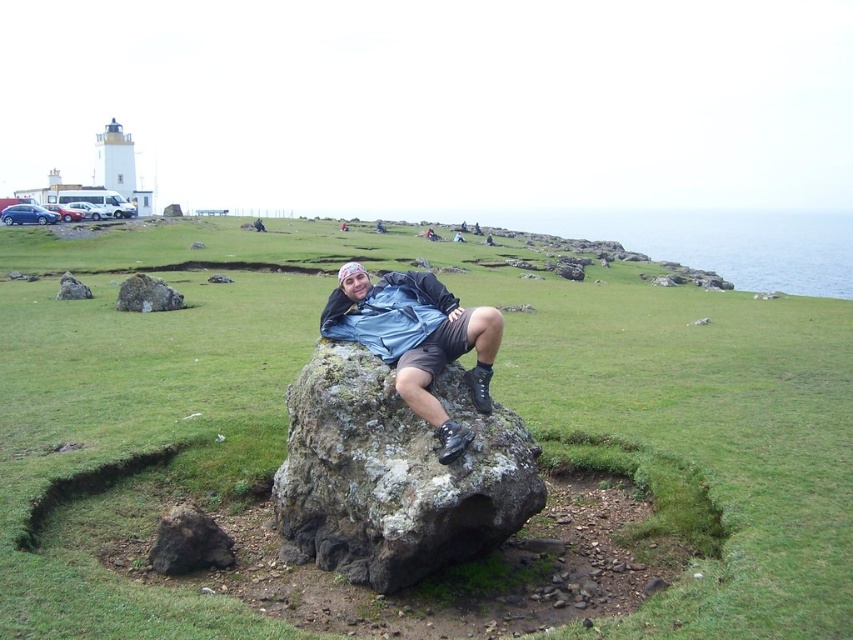
Based on the photo, is green grassy at center thinner than matte blue shirt at center?

Incorrect, green grassy at center's width is not less than matte blue shirt at center's.

Is green grassy at center taller than matte blue shirt at center?

Yes, green grassy at center is taller than matte blue shirt at center.

Does point (593, 417) lie in front of point (431, 348)?

No, (593, 417) is behind (431, 348).

At what (x,y) coordinates should I click in order to perform the action: click on green grassy at center. Please return your answer as a coordinate pair (x, y). The height and width of the screenshot is (640, 853). Looking at the image, I should click on (492, 392).

From the picture: Does rusty rock at center have a larger size compared to matte blue shirt at center?

No.

Is point (511, 531) in front of point (386, 349)?

That is True.

Which is behind, point (347, 541) or point (344, 316)?

The point (344, 316) is more distant.

What are the coordinates of `rusty rock at center` in the screenshot? It's located at (393, 474).

Does green grassy at center have a larger size compared to rusty rock at center?

Indeed, green grassy at center has a larger size compared to rusty rock at center.

Can you confirm if green grassy at center is positioned below rusty rock at center?

No, green grassy at center is not below rusty rock at center.

Describe the element at coordinates (492, 392) in the screenshot. I see `green grassy at center` at that location.

At what (x,y) coordinates should I click in order to perform the action: click on green grassy at center. Please return your answer as a coordinate pair (x, y). This screenshot has width=853, height=640. Looking at the image, I should click on (492, 392).